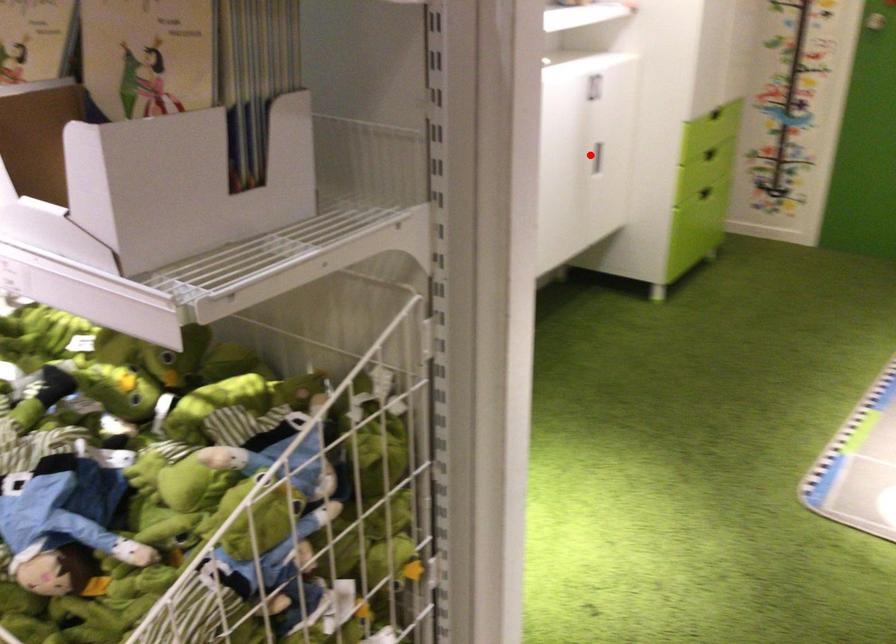
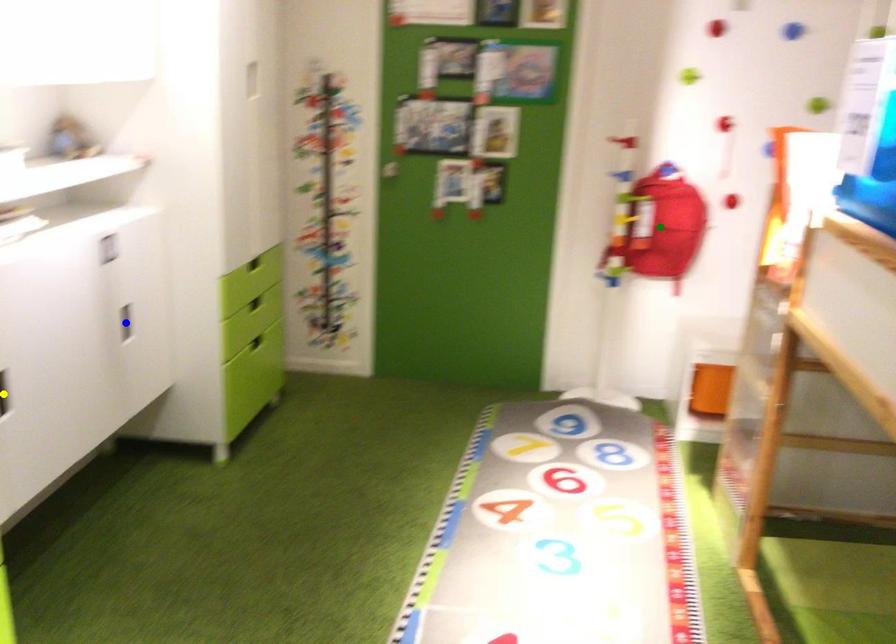
Question: I am providing you with two images of the same scene from different viewpoints. A red point is marked on the first image. You are given multiple points on the second image. In image 2, which mark is for the same physical point as the one in image 1?

Choices:
 (A) blue point
 (B) yellow point
 (C) green point

Answer: (A)